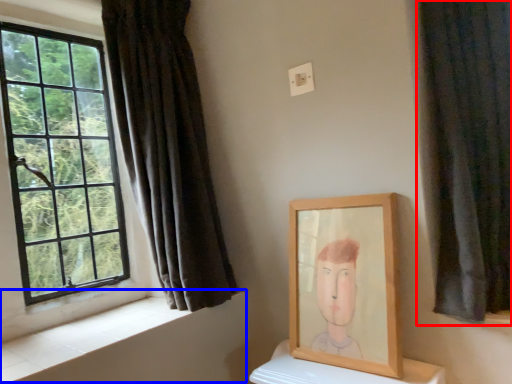
Question: Which of the following is the farthest to the observer, curtain (highlighted by a red box) or window sill (highlighted by a blue box)?

Choices:
 (A) curtain
 (B) window sill

Answer: (B)